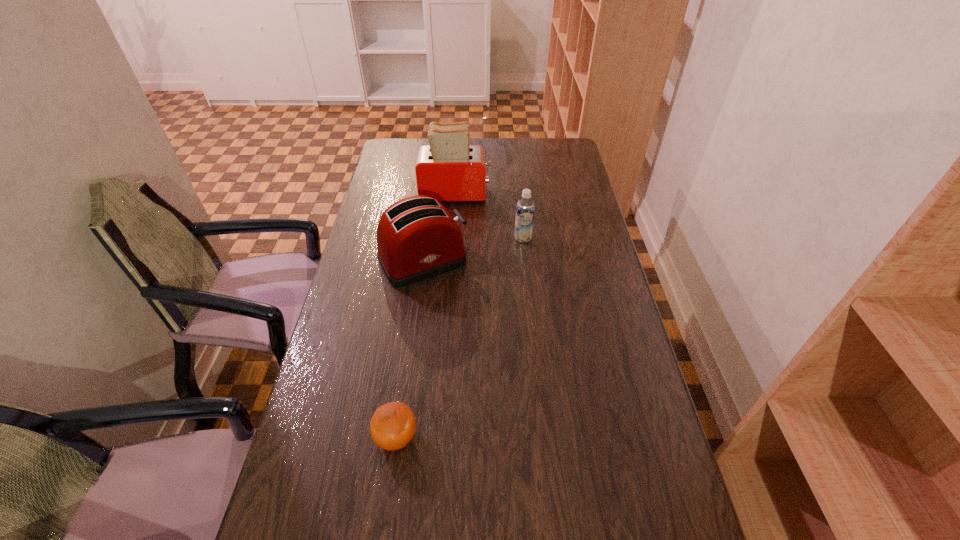
The width and height of the screenshot is (960, 540). What are the coordinates of `vacant space in between the shorter toaster and the orange` in the screenshot? It's located at (410, 349).

Where is `vacant space that's between the farther toaster and the soya milk`? The image size is (960, 540). vacant space that's between the farther toaster and the soya milk is located at coordinates (490, 216).

Find the location of a particular element. The width and height of the screenshot is (960, 540). vacant region between the rightmost object and the orange is located at coordinates (460, 338).

Find the location of `object identified as the third closest to the nearer toaster`. object identified as the third closest to the nearer toaster is located at coordinates [x=393, y=425].

Choose which object is the third nearest neighbor to the nearest object. Please provide its 2D coordinates. Your answer should be formatted as a tuple, i.e. [(x, y)], where the tuple contains the x and y coordinates of a point satisfying the conditions above.

[(449, 169)]